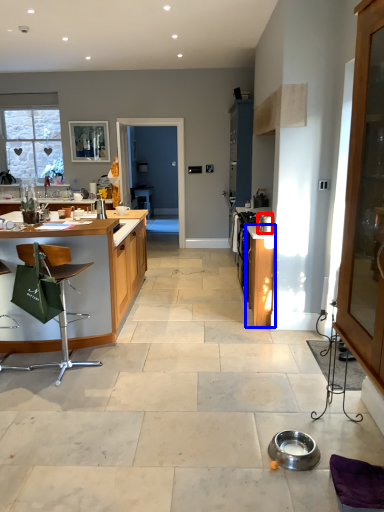
Question: Which object is closer to the camera taking this photo, appliance (highlighted by a red box) or cabinetry (highlighted by a blue box)?

Choices:
 (A) appliance
 (B) cabinetry

Answer: (A)